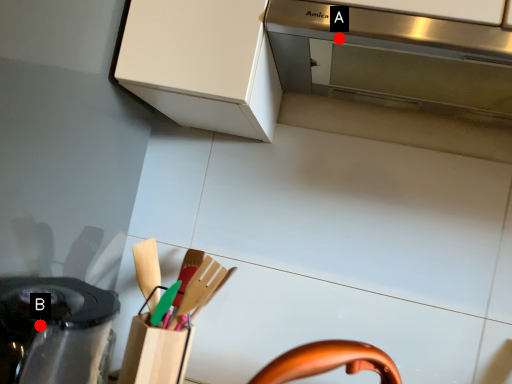
Question: Two points are circled on the image, labeled by A and B beside each circle. Which point is further to the camera?

Choices:
 (A) A is further
 (B) B is further

Answer: (A)